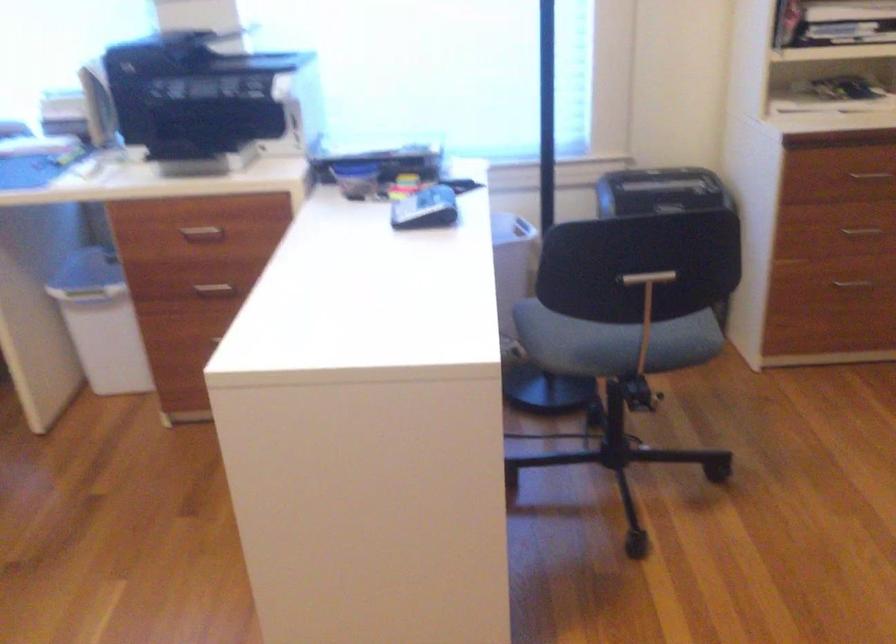
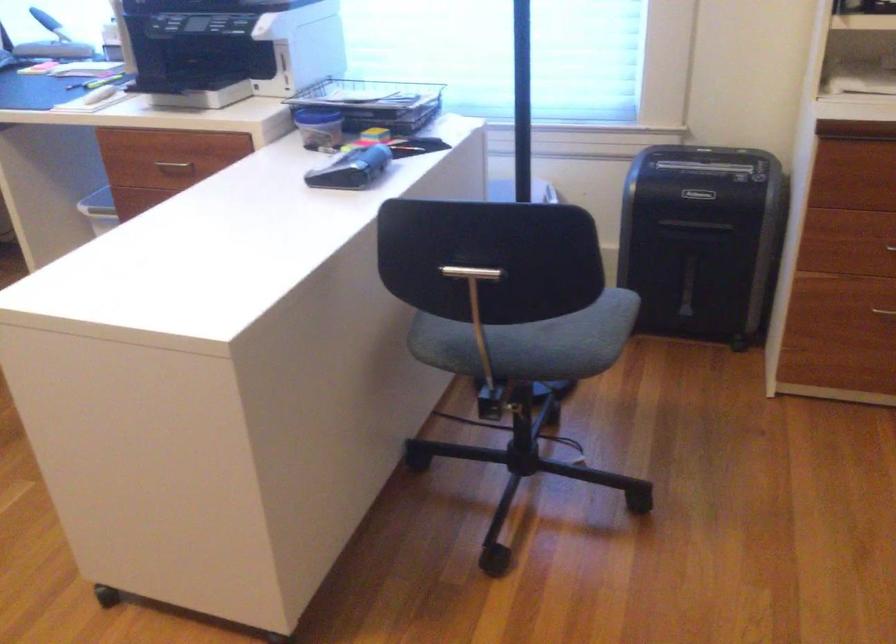
Where in the second image is the point corresponding to the point at 631,313 from the first image?

(476, 308)